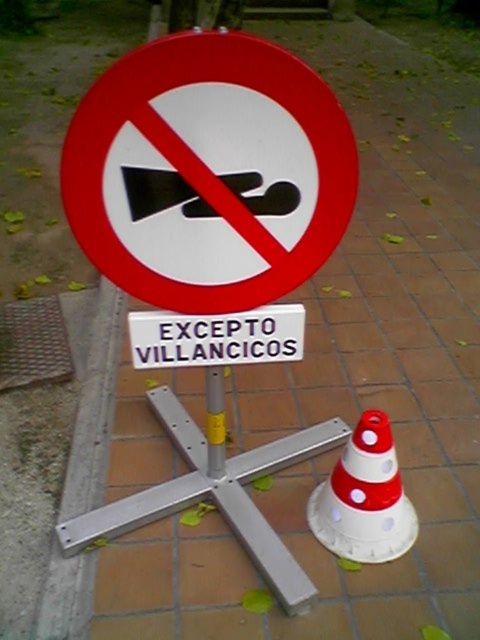
Question: Can you confirm if red plastic sign at center is positioned above white plastic sign at center?

Choices:
 (A) no
 (B) yes

Answer: (B)

Question: Does red plastic sign at center come in front of white plastic sign at center?

Choices:
 (A) yes
 (B) no

Answer: (A)

Question: Estimate the real-world distances between objects in this image. Which object is farther from the red plastic sign at center?

Choices:
 (A) yellow painted metal pole at center
 (B) white plastic traffic cone at center

Answer: (B)

Question: From the image, what is the correct spatial relationship of white plastic sign at center in relation to yellow painted metal pole at center?

Choices:
 (A) right
 (B) left

Answer: (A)

Question: Based on their relative distances, which object is nearer to the white plastic traffic cone at center?

Choices:
 (A) white plastic sign at center
 (B) yellow painted metal pole at center
 (C) red plastic sign at center

Answer: (B)

Question: Which point appears closest to the camera in this image?

Choices:
 (A) (416, 515)
 (B) (217, 397)

Answer: (B)